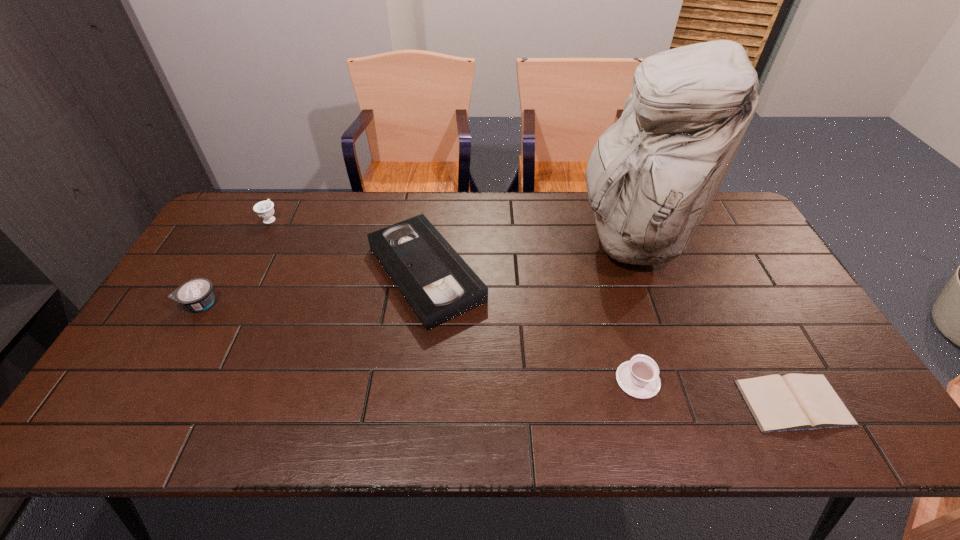
The width and height of the screenshot is (960, 540). Identify the location of vacant space that's between the tallest object and the third object from left to right. (527, 255).

Identify the location of empty space between the yogurt and the right teacup. This screenshot has height=540, width=960. (419, 341).

The height and width of the screenshot is (540, 960). Identify the location of empty space between the yogurt and the Bible. (497, 353).

The width and height of the screenshot is (960, 540). Identify the location of vacant space in between the fourth object from right to left and the nearer teacup. (532, 327).

The image size is (960, 540). I want to click on free spot between the yogurt and the left teacup, so click(x=235, y=261).

What are the coordinates of `free point between the farther teacup and the backpack` in the screenshot? It's located at (449, 228).

The image size is (960, 540). What are the coordinates of `free spot between the left teacup and the videotape` in the screenshot? It's located at point(348,246).

Locate an element on the screen. free space between the tallest object and the videotape is located at coordinates (527, 255).

Identify the location of free spot between the left teacup and the videotape. (348, 246).

The height and width of the screenshot is (540, 960). Find the location of `object that is the fourth nearest to the yogurt`. object that is the fourth nearest to the yogurt is located at coordinates (639, 377).